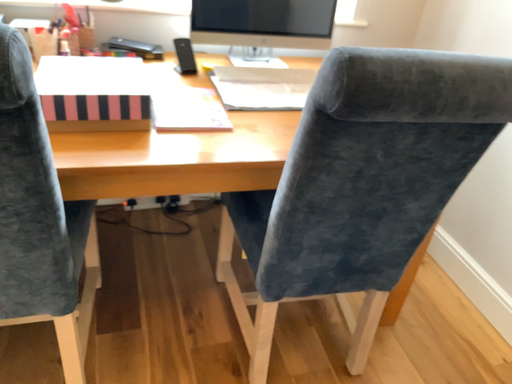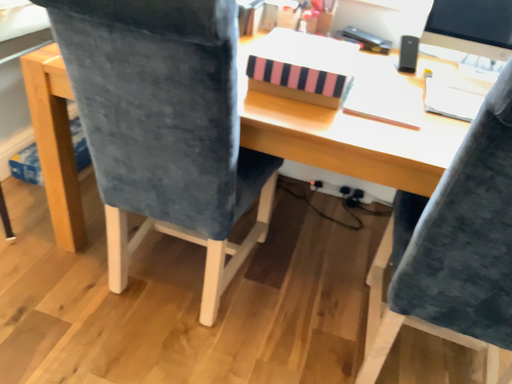
Question: How did the camera likely rotate when shooting the video?

Choices:
 (A) rotated right
 (B) rotated left

Answer: (B)